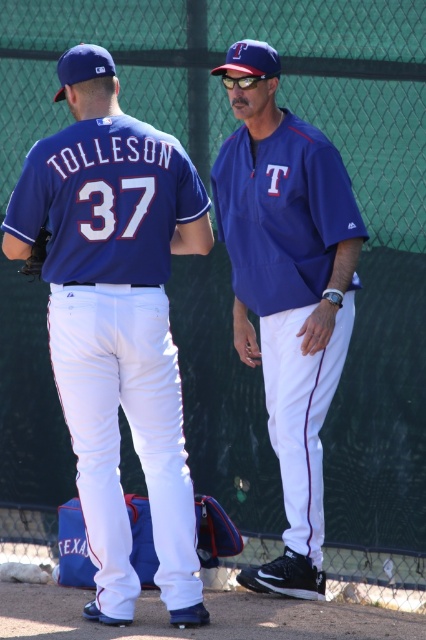
Question: Which object is the closest to the brown leather glove at lower left?

Choices:
 (A) matte blue jersey at center
 (B) matte blue uniform at center

Answer: (A)

Question: Among these objects, which one is farthest from the camera?

Choices:
 (A) matte blue jersey at center
 (B) brown leather glove at lower left

Answer: (B)

Question: Does matte blue jersey at center have a greater width compared to brown leather glove at lower left?

Choices:
 (A) no
 (B) yes

Answer: (B)

Question: In this image, where is matte blue jersey at center located relative to brown leather glove at lower left?

Choices:
 (A) left
 (B) right

Answer: (B)

Question: Which point is farther to the camera?

Choices:
 (A) brown leather glove at lower left
 (B) matte blue jersey at center

Answer: (A)

Question: Can you confirm if matte blue jersey at center is wider than matte blue uniform at center?

Choices:
 (A) no
 (B) yes

Answer: (B)